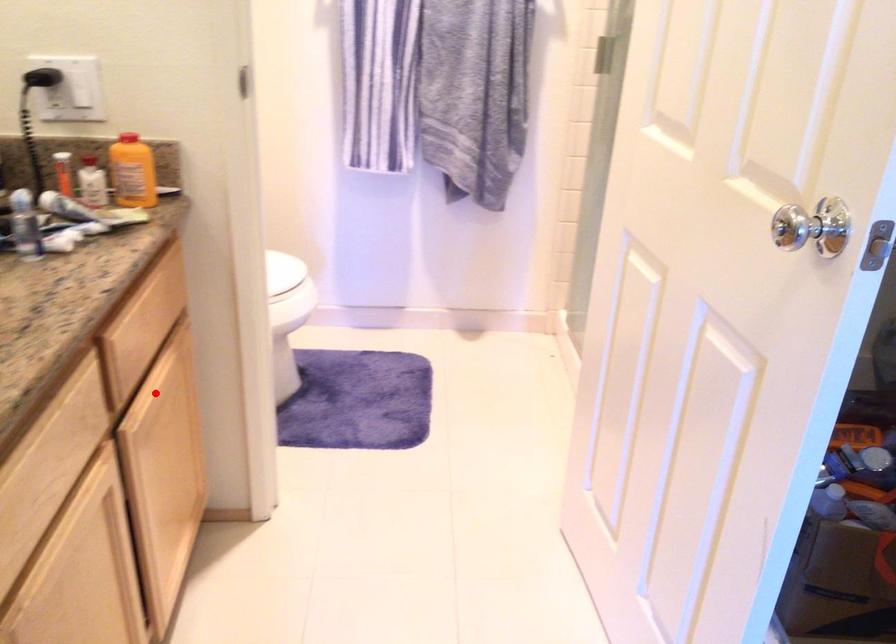
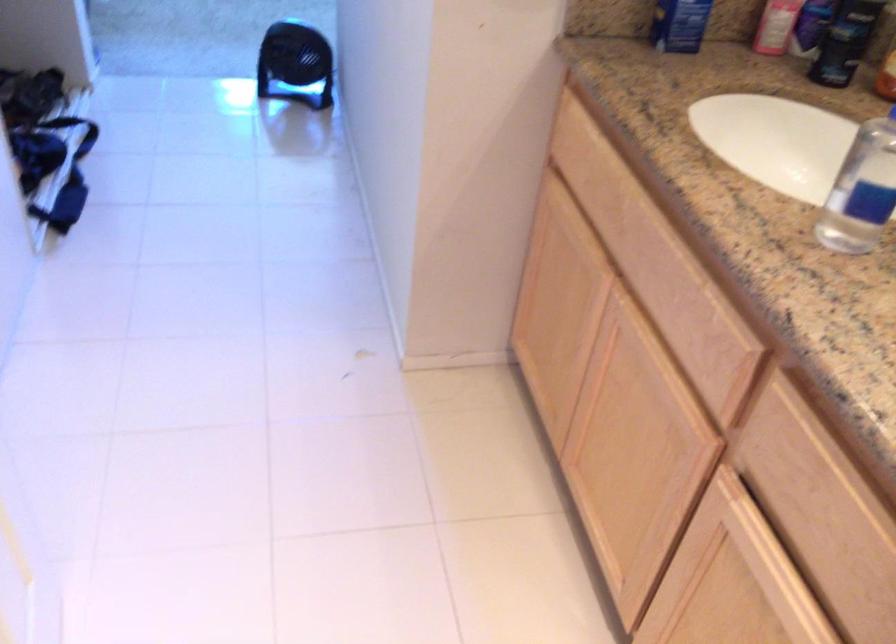
Question: I am providing you with two images of the same scene from different viewpoints. A red point is marked on the first image. Can you still see the location of the red point in image 2?

Choices:
 (A) Yes
 (B) No

Answer: (A)